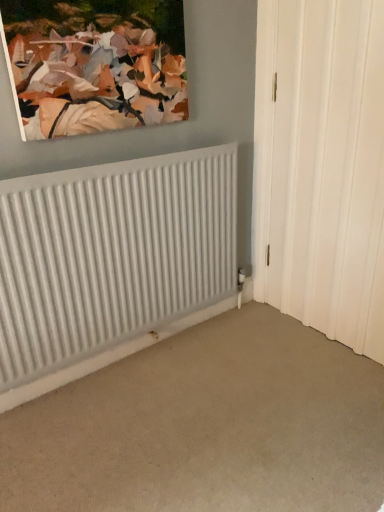
I want to click on white textured door at right, so click(x=321, y=166).

Describe the element at coordinates (321, 166) in the screenshot. Image resolution: width=384 pixels, height=512 pixels. I see `white textured door at right` at that location.

The width and height of the screenshot is (384, 512). I want to click on white textured door at right, so click(x=321, y=166).

Between white textured door at right and matte canvas painting at upper left, which one has larger size?

With larger size is white textured door at right.

Is white textured door at right far from matte canvas painting at upper left?

They are positioned close to each other.

Can you confirm if white textured door at right is taller than matte canvas painting at upper left?

Indeed, white textured door at right has a greater height compared to matte canvas painting at upper left.

Which is nearer, (335, 284) or (109, 113)?

Point (109, 113)

From the image's perspective, between white ribbed radiator at lower left and matte canvas painting at upper left, who is located below?

From the image's view, white ribbed radiator at lower left is below.

Is point (100, 172) behind point (49, 105)?

Yes, it is.

What's the angular difference between white ribbed radiator at lower left and matte canvas painting at upper left's facing directions?

They differ by 0.00303 degrees in their facing directions.

Looking at this image, how far apart are white ribbed radiator at lower left and matte canvas painting at upper left?

white ribbed radiator at lower left is 15.26 inches from matte canvas painting at upper left.

Considering the positions of objects matte canvas painting at upper left and white ribbed radiator at lower left in the image provided, who is in front, matte canvas painting at upper left or white ribbed radiator at lower left?

Positioned in front is matte canvas painting at upper left.

Considering the points (142, 63) and (145, 297), which point is behind, point (142, 63) or point (145, 297)?

The point (145, 297) is behind.

Based on the photo, is matte canvas painting at upper left positioned with its back to white ribbed radiator at lower left?

That's not correct — matte canvas painting at upper left is not looking away from white ribbed radiator at lower left.

Considering the sizes of matte canvas painting at upper left and white ribbed radiator at lower left in the image, is matte canvas painting at upper left taller or shorter than white ribbed radiator at lower left?

Clearly, matte canvas painting at upper left is shorter compared to white ribbed radiator at lower left.

Considering the sizes of objects matte canvas painting at upper left and white textured door at right in the image provided, who is taller, matte canvas painting at upper left or white textured door at right?

white textured door at right.

Is matte canvas painting at upper left thinner than white textured door at right?

In fact, matte canvas painting at upper left might be wider than white textured door at right.

Does white textured door at right appear on the left side of white ribbed radiator at lower left?

No, white textured door at right is not to the left of white ribbed radiator at lower left.

Does white textured door at right have a greater height compared to white ribbed radiator at lower left?

Indeed, white textured door at right has a greater height compared to white ribbed radiator at lower left.

Which of these two, white textured door at right or white ribbed radiator at lower left, is bigger?

white ribbed radiator at lower left is bigger.

From the picture: Considering the relative sizes of white ribbed radiator at lower left and white textured door at right in the image provided, is white ribbed radiator at lower left taller than white textured door at right?

Incorrect, the height of white ribbed radiator at lower left is not larger of that of white textured door at right.

From the image's perspective, relative to white textured door at right, is white ribbed radiator at lower left above or below?

white ribbed radiator at lower left is situated lower than white textured door at right in the image.

Where is `door that appears on the right of white ribbed radiator at lower left`? The image size is (384, 512). door that appears on the right of white ribbed radiator at lower left is located at coordinates (321, 166).

Is point (32, 222) positioned before point (279, 69)?

Yes, it is in front of point (279, 69).

In order to click on picture frame lying above the white textured door at right (from the image's perspective) in this screenshot , I will do `click(95, 64)`.

You are a GUI agent. You are given a task and a screenshot of the screen. Output one action in this format:
    pyautogui.click(x=<x>, y=<y>)
    Task: Click on the picture frame positioned vertically above the white ribbed radiator at lower left (from a real-world perspective)
    The height and width of the screenshot is (512, 384).
    Given the screenshot: What is the action you would take?
    pyautogui.click(x=95, y=64)

Looking at the image, which one is located further to white textured door at right, matte canvas painting at upper left or white ribbed radiator at lower left?

matte canvas painting at upper left.

Based on their spatial positions, is white ribbed radiator at lower left or matte canvas painting at upper left further from white textured door at right?

matte canvas painting at upper left lies further to white textured door at right than the other object.

Estimate the real-world distances between objects in this image. Which object is closer to white ribbed radiator at lower left, white textured door at right or matte canvas painting at upper left?

Answer: matte canvas painting at upper left.

Estimate the real-world distances between objects in this image. Which object is closer to white ribbed radiator at lower left, matte canvas painting at upper left or white textured door at right?

The object closer to white ribbed radiator at lower left is matte canvas painting at upper left.

Looking at the image, which one is located closer to matte canvas painting at upper left, white ribbed radiator at lower left or white textured door at right?

white ribbed radiator at lower left is closer to matte canvas painting at upper left.

Looking at the image, which one is located further to matte canvas painting at upper left, white textured door at right or white ribbed radiator at lower left?

Among the two, white textured door at right is located further to matte canvas painting at upper left.

This screenshot has height=512, width=384. What are the coordinates of `radiator situated between matte canvas painting at upper left and white textured door at right from left to right` in the screenshot? It's located at (111, 255).